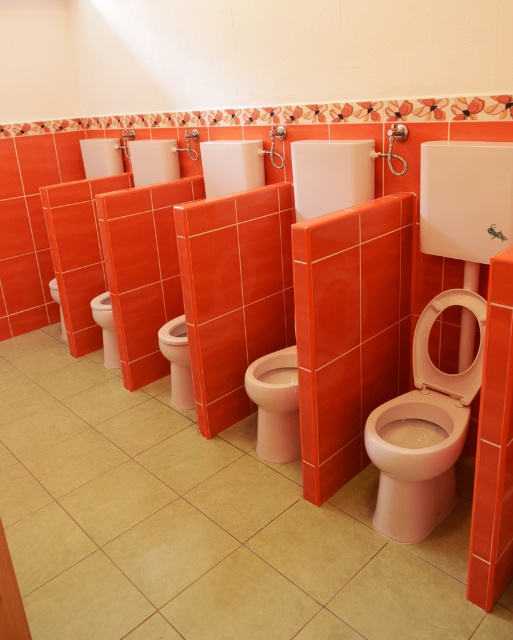
You are a maintenance worker who needs to clean the white glossy toilet at lower right and the white glossy toilet bowl at lower left. You have a 5.5 feet long cleaning rod. Can you reach both toilets from your current position without moving? Please explain.

The white glossy toilet at lower right and the white glossy toilet bowl at lower left are 6.03 feet apart. Since the cleaning rod is only 5.5 feet long, you cannot reach both toilets without moving closer to each one individually.

You are a maintenance worker inspecting the public toilets. You need to replace a part that requires the toilet to be at least 60 cm wide. Which toilet between the white glossy toilet at lower right and the white glossy toilet bowl at lower left should you choose?

The white glossy toilet at lower right has a greater width than the white glossy toilet bowl at lower left, so you should choose the white glossy toilet at lower right since it is wider and likely meets the minimum width requirement of 60 cm.

You are a maintenance worker inspecting the public toilets. You notice the matte white toilet at center and the white glossy toilet bowl at lower left. Which toilet is positioned lower in the image?

The matte white toilet at center is located below the white glossy toilet bowl at lower left, so it is positioned lower in the image.